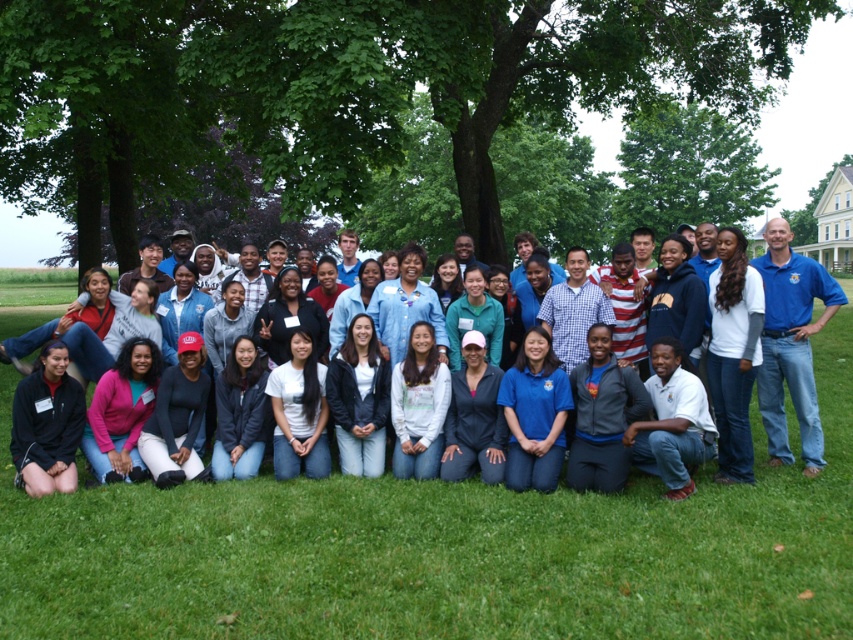
Question: Which point is closer to the camera?

Choices:
 (A) (343, 611)
 (B) (759, 262)

Answer: (A)

Question: Which point appears closest to the camera in this image?

Choices:
 (A) (49, 54)
 (B) (717, 285)
 (C) (401, 627)
 (D) (621, 214)

Answer: (C)

Question: In this image, where is green leafy tree at center located relative to blue fabric shirt at center?

Choices:
 (A) above
 (B) below

Answer: (A)

Question: Estimate the real-world distances between objects in this image. Which object is closer to the green grass at center?

Choices:
 (A) blue shirt at right
 (B) green leafy tree at upper center

Answer: (A)

Question: Does green leafy tree at upper center have a smaller size compared to white matte shirt at center?

Choices:
 (A) yes
 (B) no

Answer: (B)

Question: Does green grass at center appear on the left side of white matte shirt at center?

Choices:
 (A) yes
 (B) no

Answer: (A)